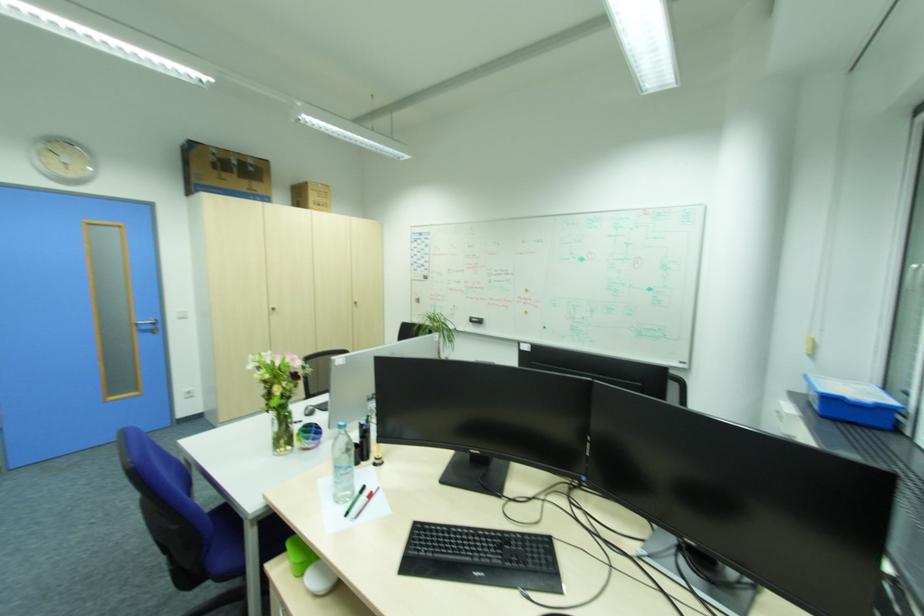
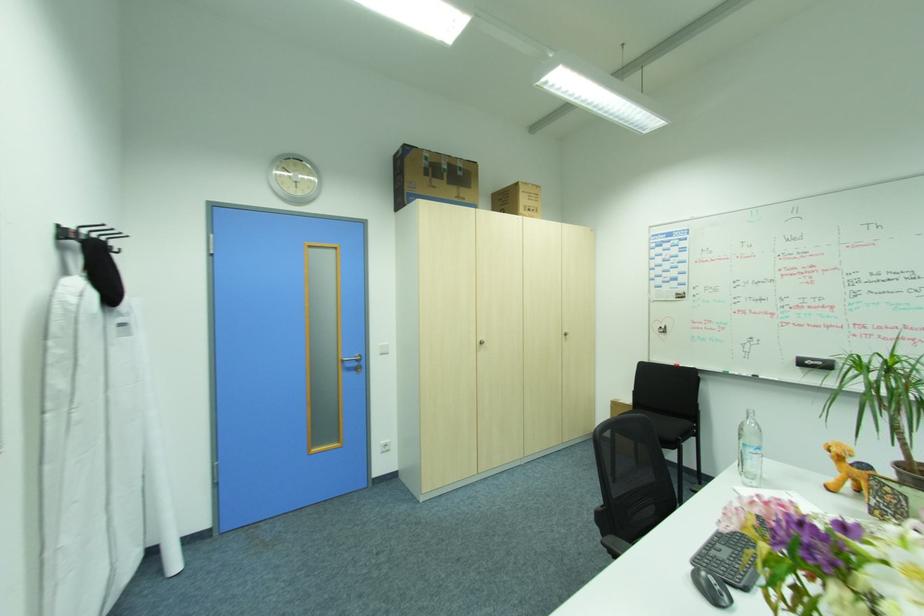
In the second image, find the point that corresponds to the point at 329,211 in the first image.

(538, 217)